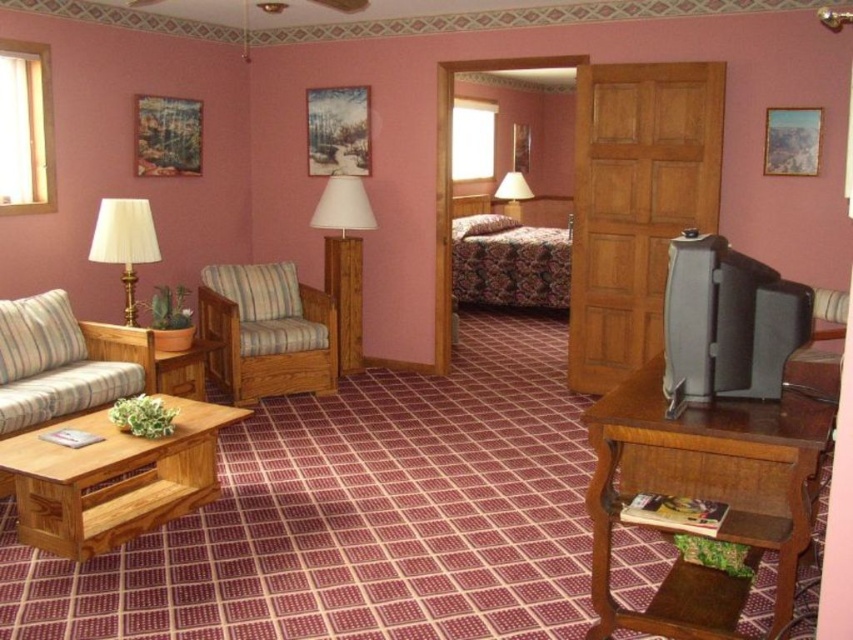
You are planning to place a new rug in the room. The rug must be large enough to cover both the wooden floor lamp at center and the wooden coffee table at lower left. Considering their sizes, which object requires the rug to be larger in area?

The wooden floor lamp at center requires the rug to be larger in area because it has a larger size compared to the wooden coffee table at lower left.